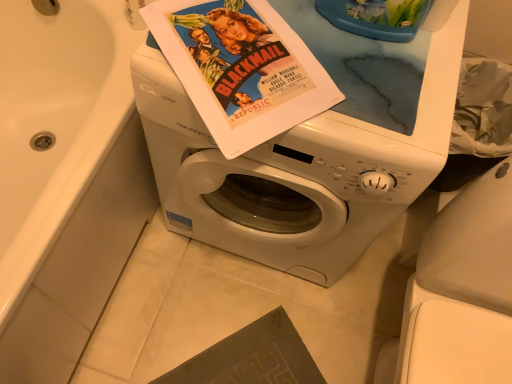
Question: From a real-world perspective, is matte paper movie poster at center below white glossy washing machine at center?

Choices:
 (A) yes
 (B) no

Answer: (B)

Question: Is matte paper movie poster at center to the right of white glossy washing machine at center from the viewer's perspective?

Choices:
 (A) yes
 (B) no

Answer: (B)

Question: Is matte paper movie poster at center positioned behind white glossy washing machine at center?

Choices:
 (A) no
 (B) yes

Answer: (B)

Question: Is white glossy washing machine at center completely or partially inside matte paper movie poster at center?

Choices:
 (A) no
 (B) yes

Answer: (A)

Question: From a real-world perspective, is matte paper movie poster at center on top of white glossy washing machine at center?

Choices:
 (A) no
 (B) yes

Answer: (B)

Question: Can you confirm if matte paper movie poster at center is bigger than white glossy washing machine at center?

Choices:
 (A) yes
 (B) no

Answer: (B)

Question: Is white glossy bathtub at upper left outside of white glossy washing machine at center?

Choices:
 (A) no
 (B) yes

Answer: (B)

Question: Is white glossy bathtub at upper left behind white glossy washing machine at center?

Choices:
 (A) no
 (B) yes

Answer: (A)

Question: Is white glossy bathtub at upper left in front of white glossy washing machine at center?

Choices:
 (A) no
 (B) yes

Answer: (B)

Question: Considering the relative sizes of white glossy bathtub at upper left and white glossy washing machine at center in the image provided, is white glossy bathtub at upper left thinner than white glossy washing machine at center?

Choices:
 (A) yes
 (B) no

Answer: (B)

Question: From the image's perspective, is white glossy bathtub at upper left on white glossy washing machine at center?

Choices:
 (A) no
 (B) yes

Answer: (B)

Question: Is white glossy bathtub at upper left at the right side of white glossy washing machine at center?

Choices:
 (A) yes
 (B) no

Answer: (B)

Question: Would you consider white glossy bathtub at upper left to be distant from matte paper movie poster at center?

Choices:
 (A) yes
 (B) no

Answer: (B)